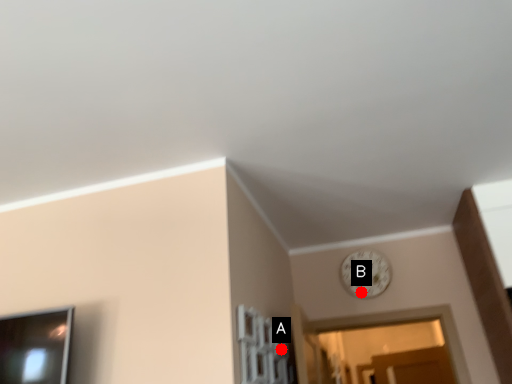
Question: Two points are circled on the image, labeled by A and B beside each circle. Which of the following is the closest to the observer?

Choices:
 (A) A is closer
 (B) B is closer

Answer: (A)